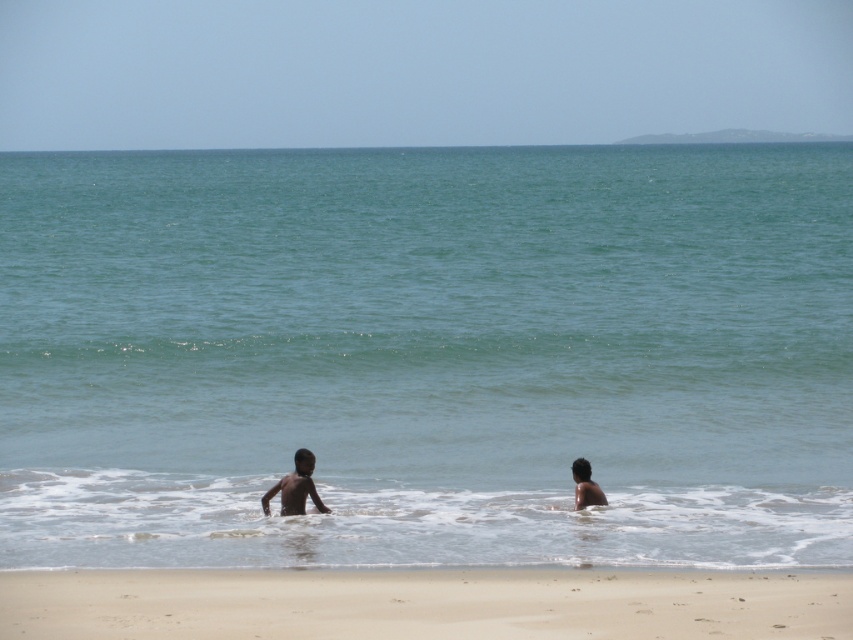
You are standing on the beach and see the clear blue water at center and the dark skin child at lower right. Which object is closer to the left side of the image?

The clear blue water at center is to the left of the dark skin child at lower right, so it is closer to the left side of the image.

You are a parent watching your child at the beach. You see the clear blue water at center and the dark skin child at lower right. Which object is higher in the image?

The clear blue water at center is much taller than the dark skin child at lower right.